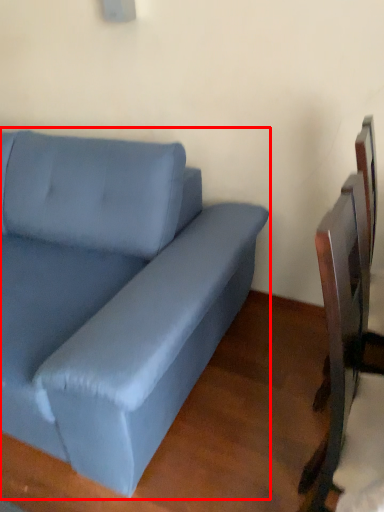
Question: Where is studio couch (annotated by the red box) located in relation to swivel chair in the image?

Choices:
 (A) left
 (B) right

Answer: (A)